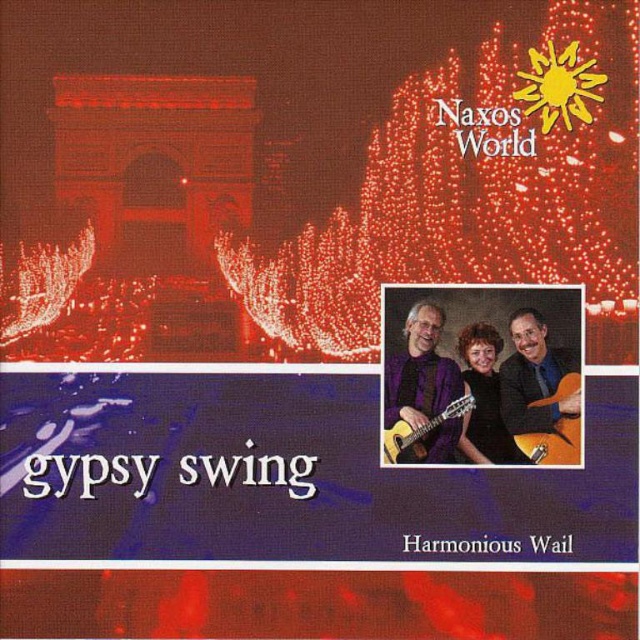
You are designing a music album cover and need to place both the purple fabric guitar at center and the light brown wooden guitar at center on the cover. Based on their sizes, which guitar should you place on the left side to ensure they fit well together?

The purple fabric guitar at center is thinner than the light brown wooden guitar at center, so placing the thinner purple fabric guitar at center on the left side would allow both guitars to fit well together on the album cover.